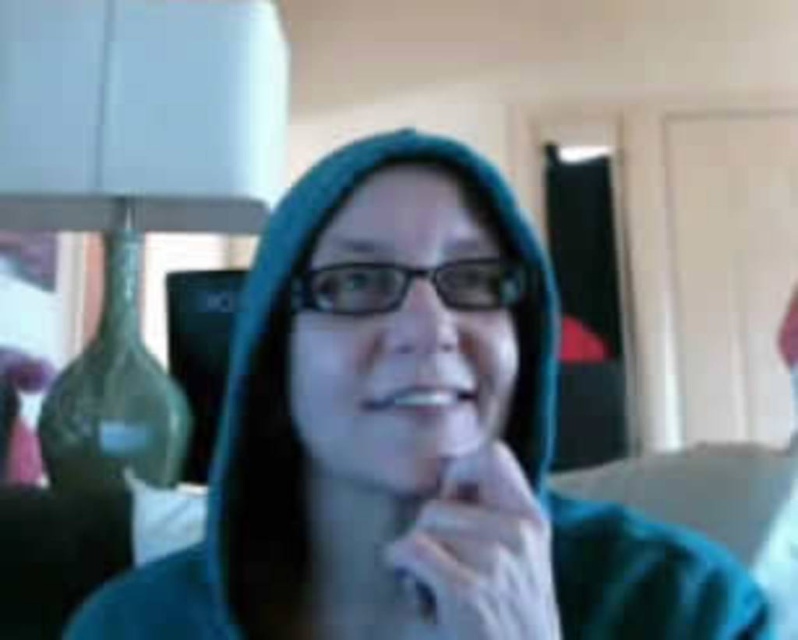
Is teal fabric hoodie at center to the left of white glossy teeth at center from the viewer's perspective?

Yes, teal fabric hoodie at center is to the left of white glossy teeth at center.

The width and height of the screenshot is (798, 640). What do you see at coordinates (409, 442) in the screenshot? I see `teal fabric hoodie at center` at bounding box center [409, 442].

Locate an element on the screen. This screenshot has height=640, width=798. teal fabric hoodie at center is located at coordinates (409, 442).

Does teal fabric hoodie at center appear under white fabric hand at center?

Yes, teal fabric hoodie at center is below white fabric hand at center.

Does teal fabric hoodie at center have a greater height compared to white fabric hand at center?

Correct, teal fabric hoodie at center is much taller as white fabric hand at center.

Does point (401, 339) come closer to viewer compared to point (448, 474)?

That is True.

Where is `teal fabric hoodie at center`? The width and height of the screenshot is (798, 640). teal fabric hoodie at center is located at coordinates (409, 442).

Does white fabric hand at center appear on the right side of white glossy teeth at center?

Yes, white fabric hand at center is to the right of white glossy teeth at center.

Between white fabric hand at center and white glossy teeth at center, which one appears on the left side from the viewer's perspective?

From the viewer's perspective, white glossy teeth at center appears more on the left side.

Where is `white fabric hand at center`? This screenshot has width=798, height=640. white fabric hand at center is located at coordinates (482, 552).